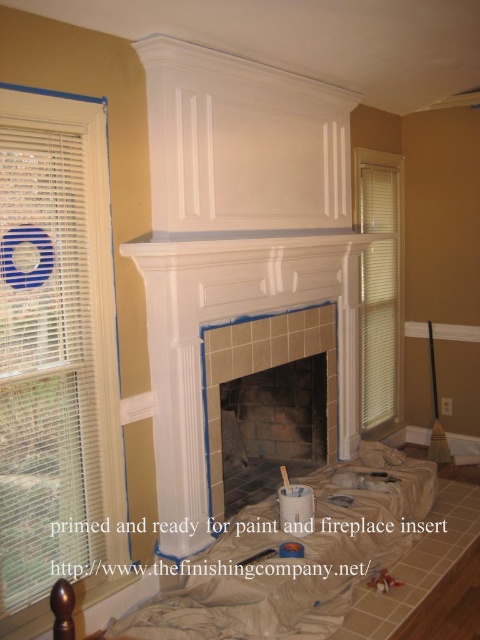
Who is taller, white blinds at left or white tile fireplace at center?

With more height is white blinds at left.

Does point (81, 552) come closer to viewer compared to point (204, 387)?

Yes, it is.

Where is `white blinds at left`? This screenshot has width=480, height=640. white blinds at left is located at coordinates (48, 362).

Between point (393, 374) and point (218, 326), which one is positioned in front?

Positioned in front is point (218, 326).

Which of these two, beige/textured blinds at right or white tile fireplace at center, stands taller?

With more height is beige/textured blinds at right.

Is point (372, 243) farther from camera compared to point (205, 336)?

Yes.

Identify the location of beige/textured blinds at right. This screenshot has height=640, width=480. (379, 284).

Who is lower down, white blinds at left or white glossy mantle at center?

white blinds at left

Who is more distant from viewer, (76, 518) or (336, 240)?

The point (336, 240) is more distant.

Locate an element on the screen. white blinds at left is located at coordinates (48, 362).

Locate an element on the screen. Image resolution: width=480 pixels, height=640 pixels. white blinds at left is located at coordinates coord(48,362).